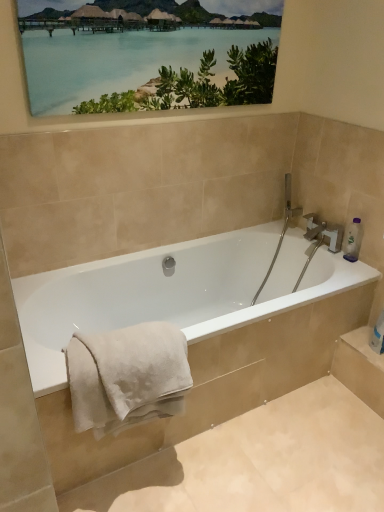
What is the approximate height of clear plastic bottle at upper right?

clear plastic bottle at upper right is 23.03 centimeters tall.

Where is `white glossy bathtub at center`? white glossy bathtub at center is located at coordinates (175, 292).

Does matte wooden picture frame at upper center have a greater width compared to white soft towel at lower left?

No.

Which is more to the left, matte wooden picture frame at upper center or white soft towel at lower left?

From the viewer's perspective, white soft towel at lower left appears more on the left side.

Is matte wooden picture frame at upper center shorter than white soft towel at lower left?

No.

From a real-world perspective, is matte wooden picture frame at upper center located beneath white soft towel at lower left?

No, from a real-world perspective, matte wooden picture frame at upper center is not beneath white soft towel at lower left.

Is matte wooden picture frame at upper center positioned with its back to clear plastic bottle at upper right?

matte wooden picture frame at upper center is not turned away from clear plastic bottle at upper right.

This screenshot has height=512, width=384. In order to click on toiletry below the matte wooden picture frame at upper center (from the image's perspective) in this screenshot , I will do `click(353, 240)`.

Is the position of matte wooden picture frame at upper center more distant than that of clear plastic bottle at upper right?

No, matte wooden picture frame at upper center is in front of clear plastic bottle at upper right.

Can you confirm if matte wooden picture frame at upper center is shorter than clear plastic bottle at upper right?

In fact, matte wooden picture frame at upper center may be taller than clear plastic bottle at upper right.

Is there a large distance between clear plastic bottle at upper right and white soft towel at lower left?

clear plastic bottle at upper right is positioned a significant distance from white soft towel at lower left.

From a real-world perspective, which is physically below, clear plastic bottle at upper right or white soft towel at lower left?

From a 3D spatial view, white soft towel at lower left is below.

Which object is more forward, clear plastic bottle at upper right or white soft towel at lower left?

white soft towel at lower left is in front.

Considering the relative sizes of clear plastic bottle at upper right and white soft towel at lower left in the image provided, is clear plastic bottle at upper right wider than white soft towel at lower left?

Incorrect, the width of clear plastic bottle at upper right does not surpass that of white soft towel at lower left.

Could you tell me if white soft towel at lower left is facing clear plastic bottle at upper right?

No, white soft towel at lower left is not turned towards clear plastic bottle at upper right.

Which object is further away from the camera, white soft towel at lower left or clear plastic bottle at upper right?

Positioned behind is clear plastic bottle at upper right.

From the image's perspective, which is above, white soft towel at lower left or clear plastic bottle at upper right?

clear plastic bottle at upper right, from the image's perspective.

In terms of height, does white soft towel at lower left look taller or shorter compared to clear plastic bottle at upper right?

Clearly, white soft towel at lower left is taller compared to clear plastic bottle at upper right.

From the image's perspective, between white soft towel at lower left and matte wooden picture frame at upper center, which one is located above?

matte wooden picture frame at upper center, from the image's perspective.

From a real-world perspective, which object rests below the other?

white soft towel at lower left.

Can you tell me how much white soft towel at lower left and matte wooden picture frame at upper center differ in facing direction?

0.000105 degrees separate the facing orientations of white soft towel at lower left and matte wooden picture frame at upper center.

Considering the sizes of objects white soft towel at lower left and matte wooden picture frame at upper center in the image provided, who is taller, white soft towel at lower left or matte wooden picture frame at upper center?

With more height is matte wooden picture frame at upper center.

Considering the sizes of objects white glossy bathtub at center and white soft towel at lower left in the image provided, who is wider, white glossy bathtub at center or white soft towel at lower left?

white glossy bathtub at center.

This screenshot has width=384, height=512. Find the location of `bathtub located on the right of white soft towel at lower left`. bathtub located on the right of white soft towel at lower left is located at coordinates (175, 292).

How many degrees apart are the facing directions of white glossy bathtub at center and white soft towel at lower left?

7.24e-06 degrees separate the facing orientations of white glossy bathtub at center and white soft towel at lower left.

Between white glossy bathtub at center and white soft towel at lower left, which one has smaller size?

white soft towel at lower left is smaller.

Considering the relative positions of matte wooden picture frame at upper center and white glossy bathtub at center in the image provided, is matte wooden picture frame at upper center behind white glossy bathtub at center?

Yes, matte wooden picture frame at upper center is behind white glossy bathtub at center.

How different are the orientations of matte wooden picture frame at upper center and white glossy bathtub at center in degrees?

The angular difference between matte wooden picture frame at upper center and white glossy bathtub at center is 0.000113 degrees.

Considering the relative sizes of matte wooden picture frame at upper center and white glossy bathtub at center in the image provided, is matte wooden picture frame at upper center bigger than white glossy bathtub at center?

No.

This screenshot has height=512, width=384. What are the coordinates of `bath towel that appears below the matte wooden picture frame at upper center (from a real-world perspective)` in the screenshot? It's located at (127, 376).

Where is `picture frame above the clear plastic bottle at upper right (from a real-world perspective)`? Image resolution: width=384 pixels, height=512 pixels. picture frame above the clear plastic bottle at upper right (from a real-world perspective) is located at coordinates (148, 53).

Which object lies further to the anchor point matte wooden picture frame at upper center, white glossy bathtub at center or clear plastic bottle at upper right?

clear plastic bottle at upper right lies further to matte wooden picture frame at upper center than the other object.

Which object lies nearer to the anchor point clear plastic bottle at upper right, white glossy bathtub at center or white soft towel at lower left?

white glossy bathtub at center is positioned closer to the anchor clear plastic bottle at upper right.

Considering their positions, is white soft towel at lower left positioned further to clear plastic bottle at upper right than matte wooden picture frame at upper center?

The object further to clear plastic bottle at upper right is white soft towel at lower left.

From the image, which object appears to be nearer to clear plastic bottle at upper right, matte wooden picture frame at upper center or white soft towel at lower left?

matte wooden picture frame at upper center is closer to clear plastic bottle at upper right.

Estimate the real-world distances between objects in this image. Which object is further from white glossy bathtub at center, white soft towel at lower left or clear plastic bottle at upper right?

Among the two, clear plastic bottle at upper right is located further to white glossy bathtub at center.

Considering their positions, is white soft towel at lower left positioned closer to clear plastic bottle at upper right than white glossy bathtub at center?

white glossy bathtub at center is positioned closer to the anchor clear plastic bottle at upper right.

Which object lies nearer to the anchor point white glossy bathtub at center, clear plastic bottle at upper right or white soft towel at lower left?

white soft towel at lower left is positioned closer to the anchor white glossy bathtub at center.

From the image, which object appears to be nearer to white soft towel at lower left, white glossy bathtub at center or clear plastic bottle at upper right?

Based on the image, white glossy bathtub at center appears to be nearer to white soft towel at lower left.

You are a GUI agent. You are given a task and a screenshot of the screen. Output one action in this format:
    pyautogui.click(x=<x>, y=<y>)
    Task: Click on the toiletry between matte wooden picture frame at upper center and white soft towel at lower left in the vertical direction
    The width and height of the screenshot is (384, 512).
    Given the screenshot: What is the action you would take?
    pyautogui.click(x=353, y=240)

You are a GUI agent. You are given a task and a screenshot of the screen. Output one action in this format:
    pyautogui.click(x=<x>, y=<y>)
    Task: Click on the bathtub located between white soft towel at lower left and clear plastic bottle at upper right in the left-right direction
    
    Given the screenshot: What is the action you would take?
    pyautogui.click(x=175, y=292)

What are the coordinates of `toiletry between matte wooden picture frame at upper center and white glossy bathtub at center in the vertical direction` in the screenshot? It's located at tap(353, 240).

You are a GUI agent. You are given a task and a screenshot of the screen. Output one action in this format:
    pyautogui.click(x=<x>, y=<y>)
    Task: Click on the bathtub between matte wooden picture frame at upper center and white soft towel at lower left from top to bottom
    
    Given the screenshot: What is the action you would take?
    pyautogui.click(x=175, y=292)